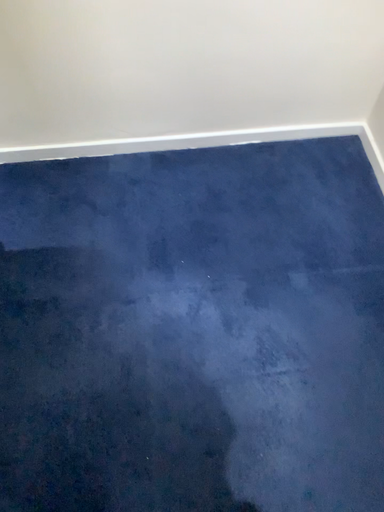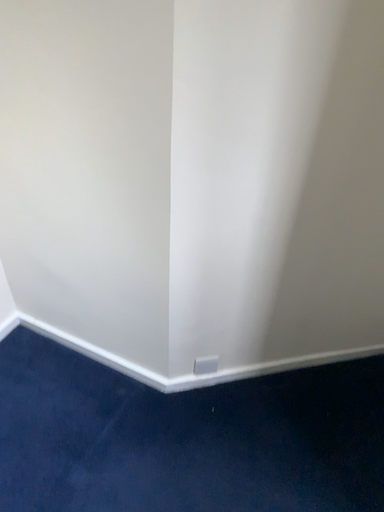
Question: Which way did the camera rotate in the video?

Choices:
 (A) rotated left
 (B) rotated right

Answer: (B)